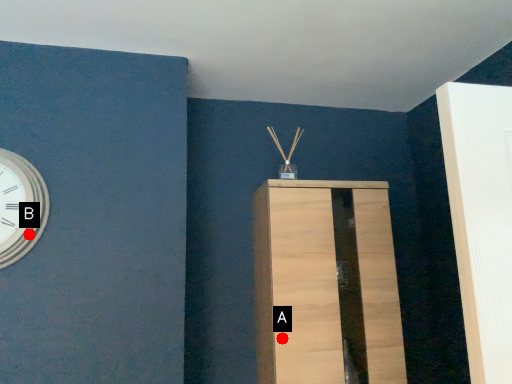
Question: Two points are circled on the image, labeled by A and B beside each circle. Which of the following is the farthest from the observer?

Choices:
 (A) A is further
 (B) B is further

Answer: (A)